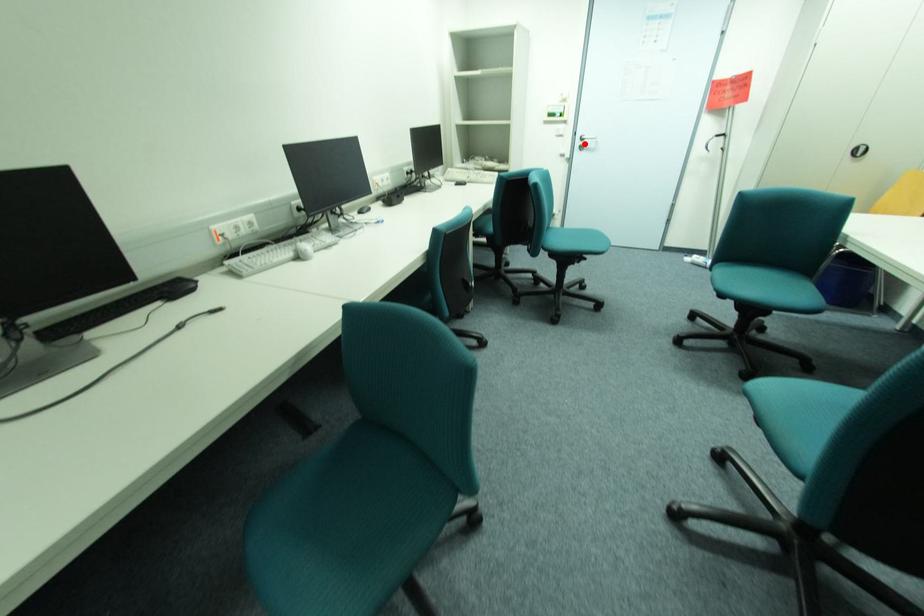
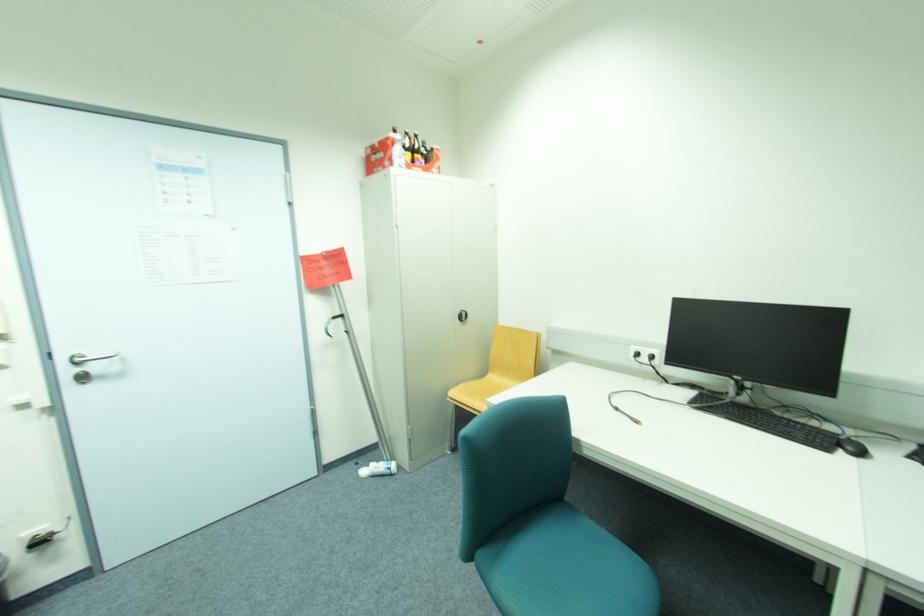
Question: I am providing you with two images of the same scene from different viewpoints. Given a red point in image1, look at the same physical point in image2. Is it:

Choices:
 (A) Closer to the viewpoint
 (B) Farther from the viewpoint

Answer: (B)